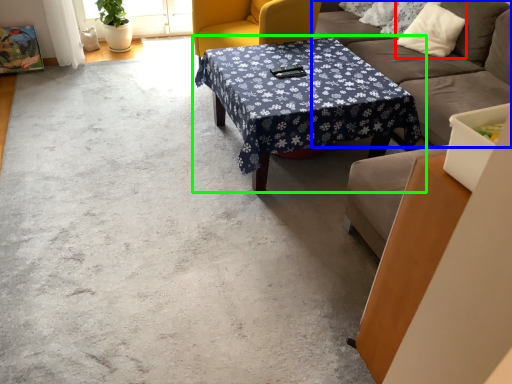
Question: Which is farther away from pillow (highlighted by a red box)? studio couch (highlighted by a blue box) or coffee table (highlighted by a green box)?

Choices:
 (A) studio couch
 (B) coffee table

Answer: (B)